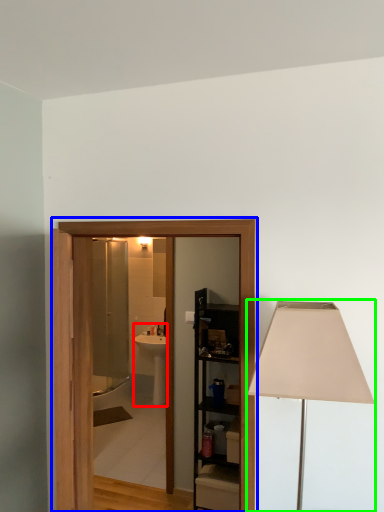
Question: Estimate the real-world distances between objects in this image. Which object is farther from sink (highlighted by a red box), barn door (highlighted by a blue box) or lamp (highlighted by a green box)?

Choices:
 (A) barn door
 (B) lamp

Answer: (B)